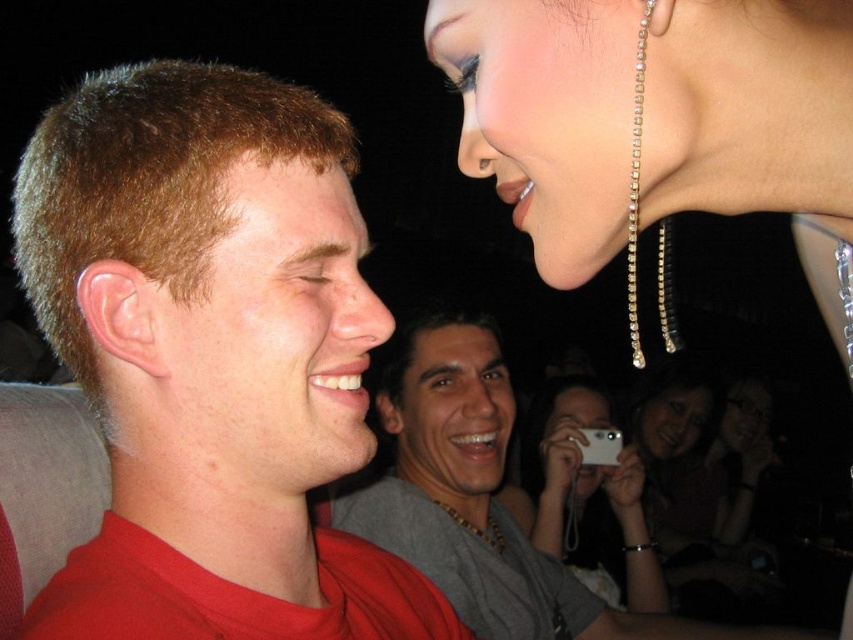
Question: Is white plastic phone at center positioned behind gold chain necklace at center?

Choices:
 (A) yes
 (B) no

Answer: (A)

Question: Estimate the real-world distances between objects in this image. Which object is closer to the gray necklace at center?

Choices:
 (A) white plastic phone at center
 (B) gold chain necklace at center
 (C) matte red shirt at left
 (D) matte black camera at center

Answer: (B)

Question: Which point is closer to the camera taking this photo?

Choices:
 (A) (x=466, y=522)
 (B) (x=627, y=515)
 (C) (x=619, y=451)

Answer: (A)

Question: Can you confirm if gray necklace at center is smaller than gold chain necklace at center?

Choices:
 (A) yes
 (B) no

Answer: (B)

Question: Estimate the real-world distances between objects in this image. Which object is farther from the white plastic phone at center?

Choices:
 (A) gold chain necklace at center
 (B) gray necklace at center

Answer: (B)

Question: Does matte black camera at center have a greater width compared to gold chain necklace at center?

Choices:
 (A) yes
 (B) no

Answer: (A)